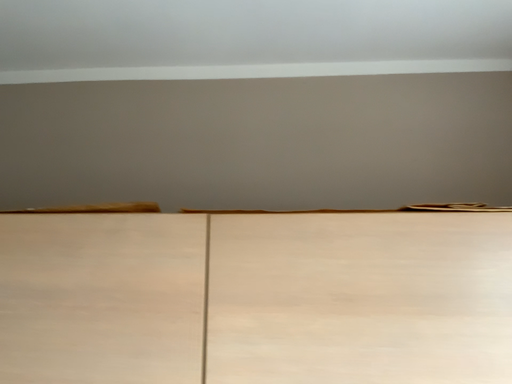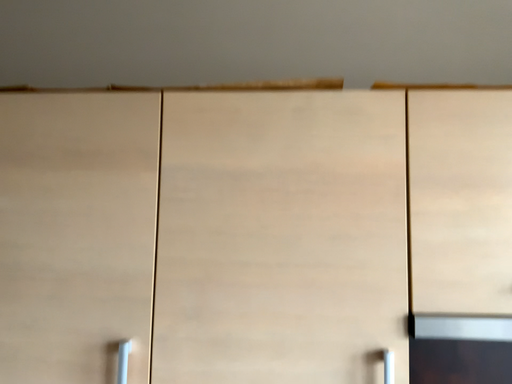
Question: How did the camera likely rotate when shooting the video?

Choices:
 (A) rotated upward
 (B) rotated downward

Answer: (B)